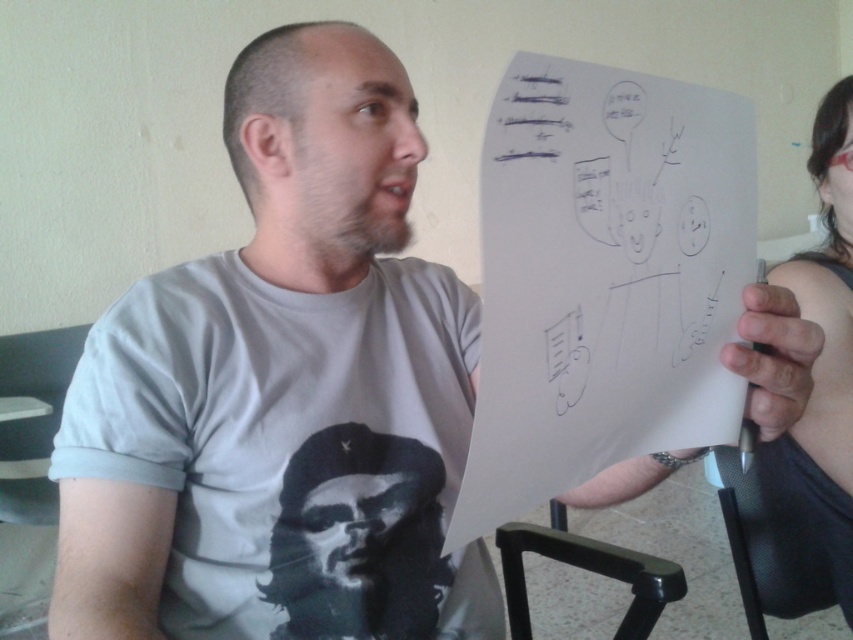
Question: Is white paper at upper right above black ink lines at upper center?

Choices:
 (A) no
 (B) yes

Answer: (A)

Question: Does black matte t-shirt at center appear on the right side of smooth skin hand holding whiteboard at right?

Choices:
 (A) no
 (B) yes

Answer: (A)

Question: Does black matte t-shirt at center appear over smooth skin hand holding whiteboard at right?

Choices:
 (A) no
 (B) yes

Answer: (A)

Question: Among these objects, which one is farthest from the camera?

Choices:
 (A) black plastic chair at lower center
 (B) smooth skin hand holding whiteboard at right
 (C) black matte t-shirt at center

Answer: (B)

Question: Estimate the real-world distances between objects in this image. Which object is farther from the black ink lines at upper center?

Choices:
 (A) black plastic chair at lower center
 (B) smooth skin hand holding whiteboard at right

Answer: (B)

Question: Based on their relative distances, which object is nearer to the black plastic chair at lower center?

Choices:
 (A) white paper at upper right
 (B) black matte t-shirt at center

Answer: (B)